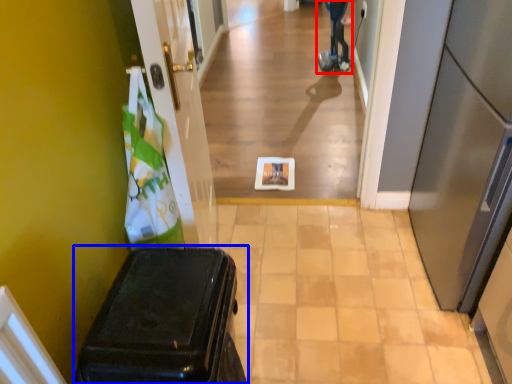
Question: Which point is further to the camera, mobility scooter (highlighted by a red box) or suitcase (highlighted by a blue box)?

Choices:
 (A) mobility scooter
 (B) suitcase

Answer: (A)